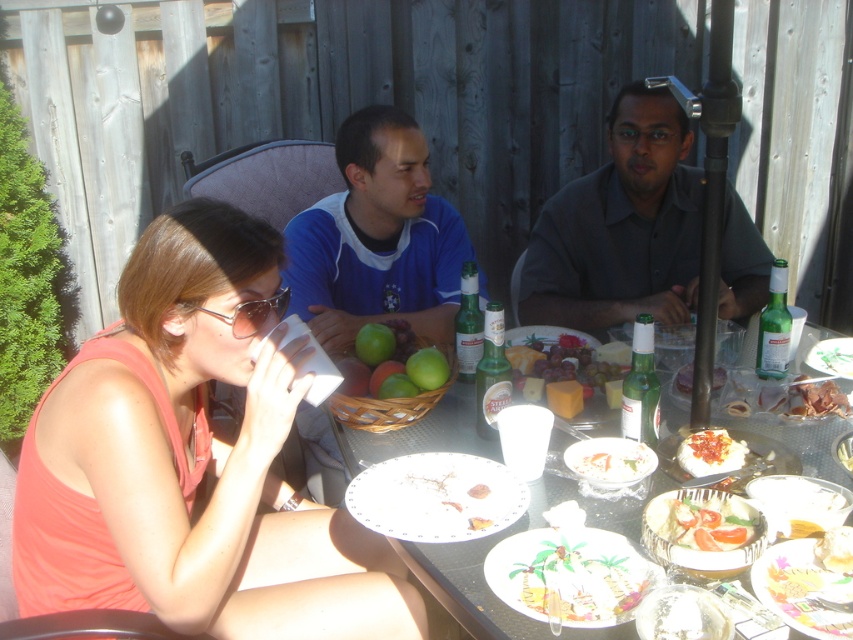
Question: Which of the following is the farthest from the observer?

Choices:
 (A) (102, 444)
 (B) (712, 540)
 (C) (613, 362)

Answer: (C)

Question: Is white paper plates at center thinner than white creamy sauce at center?

Choices:
 (A) yes
 (B) no

Answer: (B)

Question: Among these points, which one is nearest to the camera?

Choices:
 (A) (577, 275)
 (B) (693, 518)
 (C) (363, 394)

Answer: (B)

Question: Does tomato salad with dressing at center lie behind green matte apples at center?

Choices:
 (A) no
 (B) yes

Answer: (A)

Question: Which of the following is the farthest from the observer?

Choices:
 (A) smooth yellow cake at lower right
 (B) dark gray shirt at center
 (C) blue jersey at center

Answer: (B)

Question: Observing the image, what is the correct spatial positioning of dark gray shirt at center in reference to blue jersey at center?

Choices:
 (A) above
 (B) below

Answer: (A)